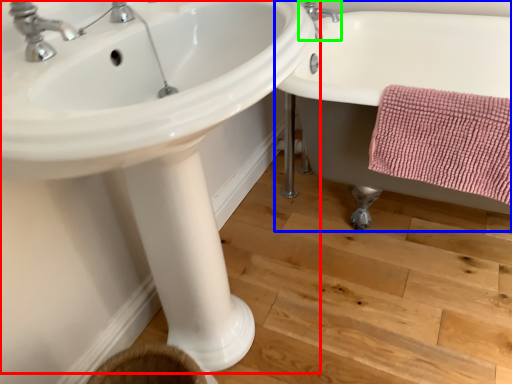
Question: Which is farther away from sink (highlighted by a red box)? bathtub (highlighted by a blue box) or tap (highlighted by a green box)?

Choices:
 (A) bathtub
 (B) tap

Answer: (B)